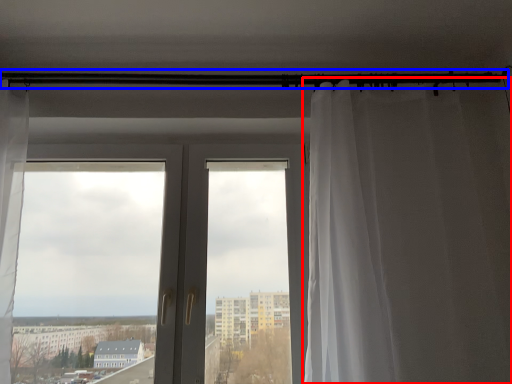
Question: Which point is further to the camera, curtain (highlighted by a red box) or beam (highlighted by a blue box)?

Choices:
 (A) curtain
 (B) beam

Answer: (B)